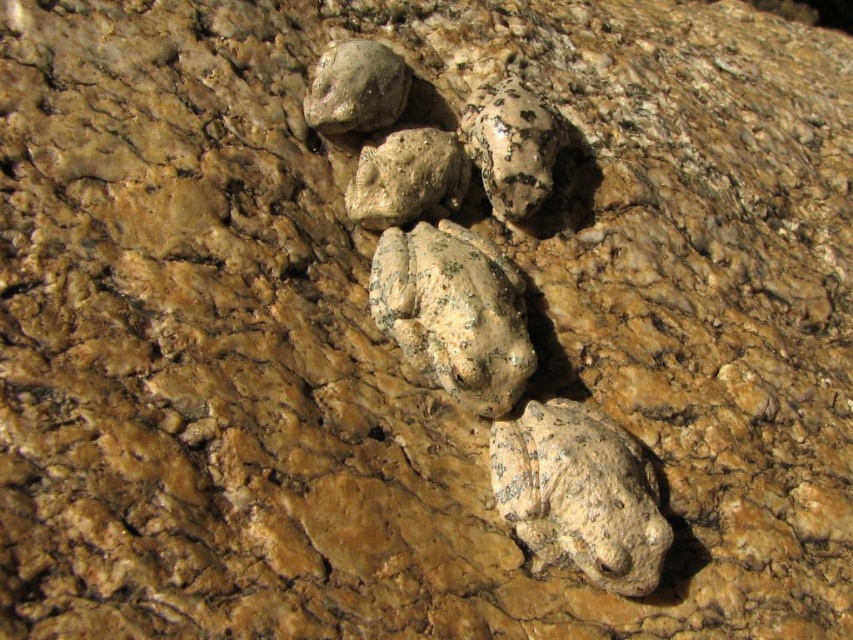
You are standing 3 feet away from the speckled stone frog at upper center. Can you reach it without moving your feet?

The speckled stone frog at upper center is 36.97 inches away from the viewer. Since 3 feet equals 36 inches, you are slightly closer than the frog, so you can reach it without moving your feet.

You are an observer looking at the rock surface. There is a point marked at coordinates [579,493]. What object is located at this point?

The point at [579,493] marks the location of the speckled stone frog at lower right.

You are observing the rock surface and notice two points marked on it. Which point is closer to you, point (641,520) or point (407,88)?

Point (641,520) is closer to you because it is in front of point (407,88).